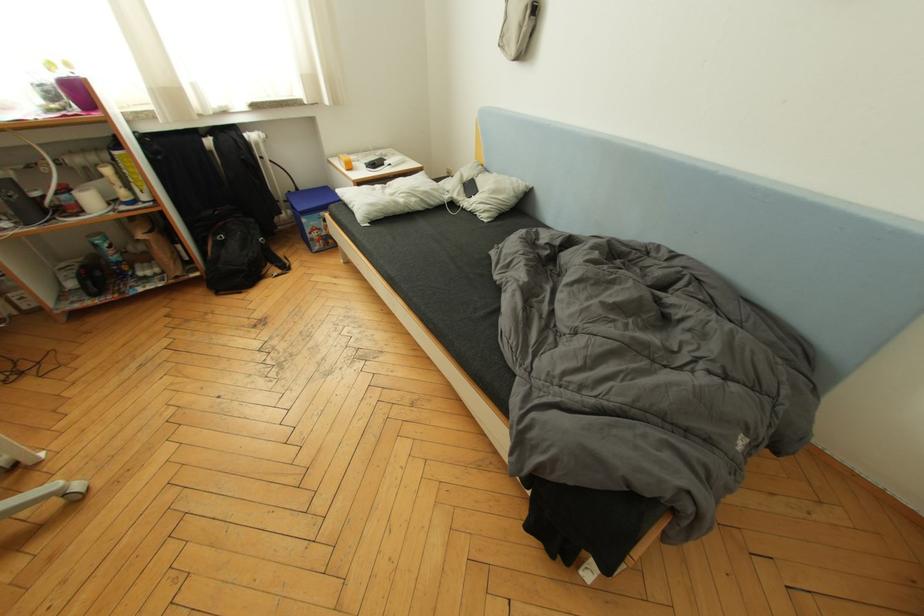
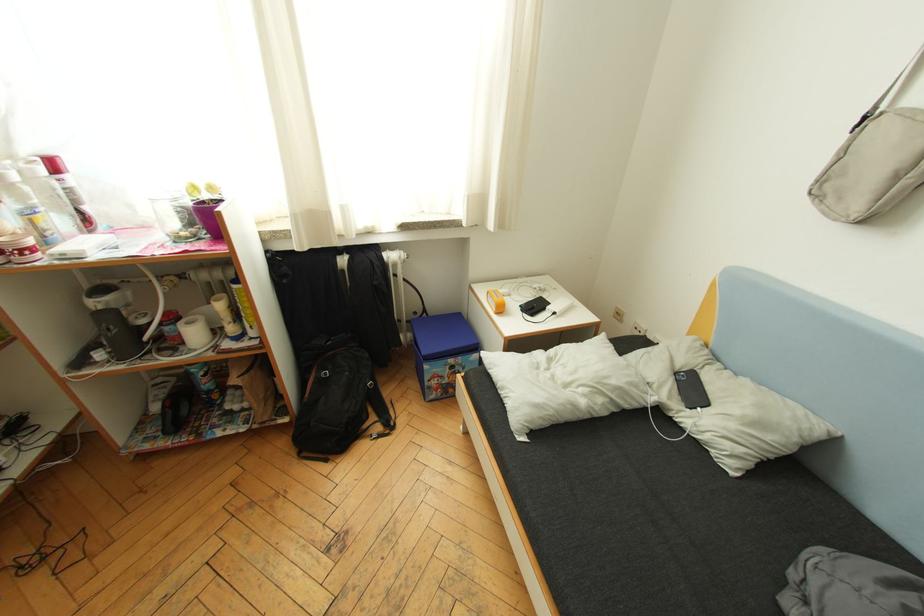
What movement of the cameraman would produce the second image?

The cameraman moved toward left, forward.